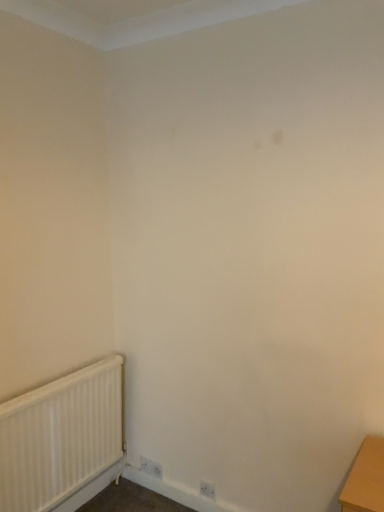
Question: Is white plastic radiator at lower left aimed at white plastic electric outlet at lower center?

Choices:
 (A) no
 (B) yes

Answer: (A)

Question: Is white plastic radiator at lower left far from white plastic electric outlet at lower center?

Choices:
 (A) yes
 (B) no

Answer: (B)

Question: Is white plastic radiator at lower left closer to camera compared to white plastic electric outlet at lower center?

Choices:
 (A) no
 (B) yes

Answer: (B)

Question: Considering the relative sizes of white plastic radiator at lower left and white plastic electric outlet at lower center in the image provided, is white plastic radiator at lower left smaller than white plastic electric outlet at lower center?

Choices:
 (A) no
 (B) yes

Answer: (A)

Question: From a real-world perspective, is white plastic radiator at lower left physically below white plastic electric outlet at lower center?

Choices:
 (A) no
 (B) yes

Answer: (A)

Question: From the image's perspective, is white plastic radiator at lower left above white plastic electric outlet at lower center?

Choices:
 (A) yes
 (B) no

Answer: (A)

Question: Is white plastic electric outlet at lower center oriented towards white plastic radiator at lower left?

Choices:
 (A) no
 (B) yes

Answer: (A)

Question: Can you confirm if white plastic electric outlet at lower center is positioned to the right of white plastic radiator at lower left?

Choices:
 (A) yes
 (B) no

Answer: (A)

Question: Is white plastic electric outlet at lower center looking in the opposite direction of white plastic radiator at lower left?

Choices:
 (A) yes
 (B) no

Answer: (B)

Question: From the image's perspective, does white plastic electric outlet at lower center appear lower than white plastic radiator at lower left?

Choices:
 (A) no
 (B) yes

Answer: (B)

Question: Is white plastic electric outlet at lower center beside white plastic radiator at lower left?

Choices:
 (A) no
 (B) yes

Answer: (A)

Question: Is white plastic electric outlet at lower center positioned far away from white plastic radiator at lower left?

Choices:
 (A) yes
 (B) no

Answer: (B)

Question: Visually, is white plastic radiator at lower left positioned to the left or to the right of white plastic electric outlet at lower center?

Choices:
 (A) left
 (B) right

Answer: (A)